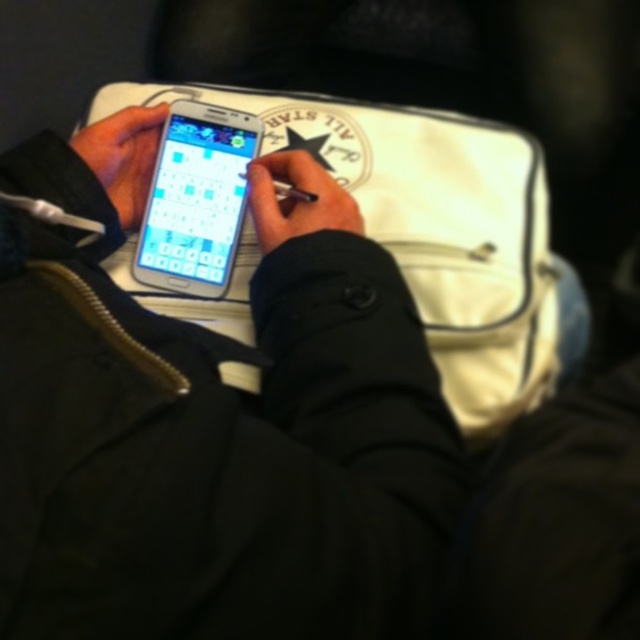
Is black matte phone at center further to the viewer compared to white fabric bag at center?

No, it is in front of white fabric bag at center.

Who is more distant from viewer, (100, 316) or (468, 317)?

The point (468, 317) is behind.

Locate an element on the screen. The width and height of the screenshot is (640, 640). black matte phone at center is located at coordinates (209, 432).

Does point (540, 332) come farther from viewer compared to point (138, 118)?

No.

Which is behind, point (499, 269) or point (122, 118)?

The point (122, 118) is behind.

Where is `white fabric bag at center`? white fabric bag at center is located at coordinates (432, 228).

Does white fabric bag at center have a smaller size compared to black matte pen at center?

Incorrect, white fabric bag at center is not smaller in size than black matte pen at center.

The height and width of the screenshot is (640, 640). What do you see at coordinates (432, 228) in the screenshot?
I see `white fabric bag at center` at bounding box center [432, 228].

Find the location of `white fabric bag at center`. white fabric bag at center is located at coordinates (x=432, y=228).